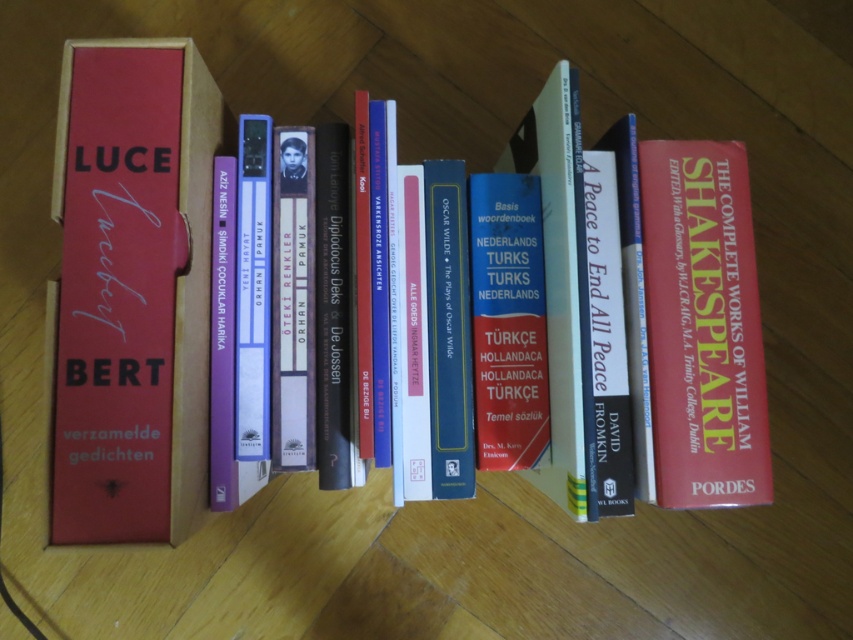
Who is taller, matte red book at left or hardcover book at right?

matte red book at left is taller.

Does matte red book at left have a greater width compared to hardcover book at right?

Incorrect, matte red book at left's width does not surpass hardcover book at right's.

You are a GUI agent. You are given a task and a screenshot of the screen. Output one action in this format:
    pyautogui.click(x=<x>, y=<y>)
    Task: Click on the matte red book at left
    
    Given the screenshot: What is the action you would take?
    pyautogui.click(x=115, y=292)

Who is positioned more to the left, hardcover books at center or hardcover book at right?

hardcover books at center is more to the left.

Is hardcover books at center taller than hardcover book at right?

Yes, hardcover books at center is taller than hardcover book at right.

This screenshot has width=853, height=640. What do you see at coordinates (134, 291) in the screenshot? I see `hardcover books at center` at bounding box center [134, 291].

Find the location of a particular element. This screenshot has height=640, width=853. hardcover books at center is located at coordinates (134, 291).

Which is above, blue hardcover book at center or hardcover book at center?

hardcover book at center

Is point (529, 465) farther from camera compared to point (306, 172)?

No.

Find the location of a particular element. blue hardcover book at center is located at coordinates (508, 321).